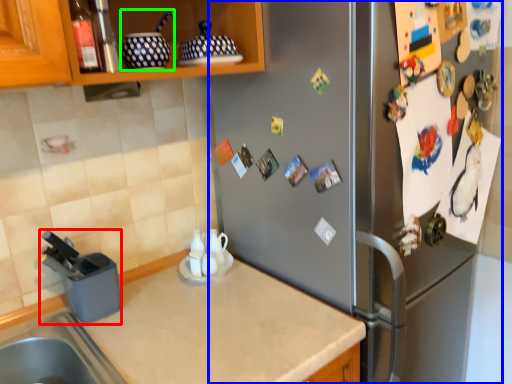
Question: Which object is the farthest from appliance (highlighted by a red box)? Choose among these: fridge (highlighted by a blue box) or appliance (highlighted by a green box).

Choices:
 (A) fridge
 (B) appliance

Answer: (A)